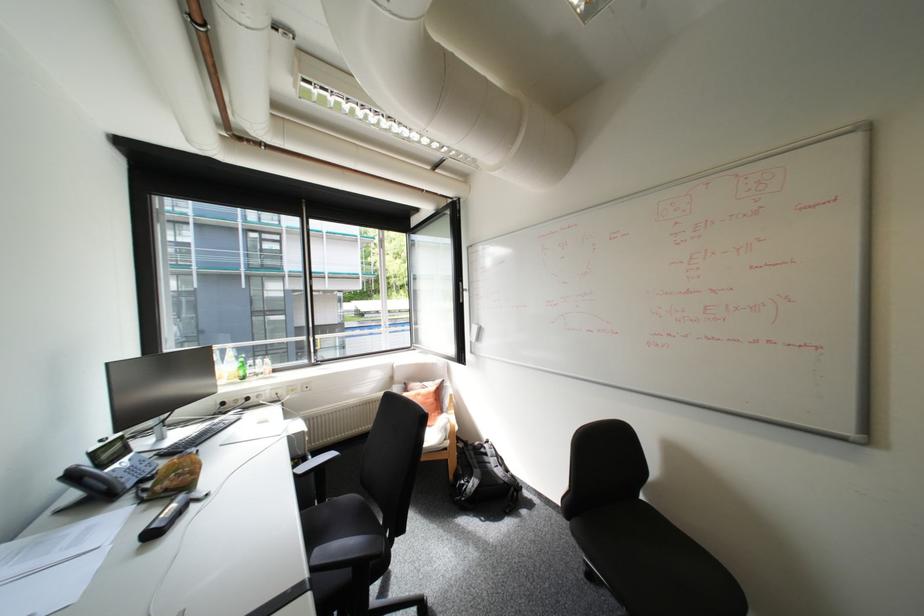
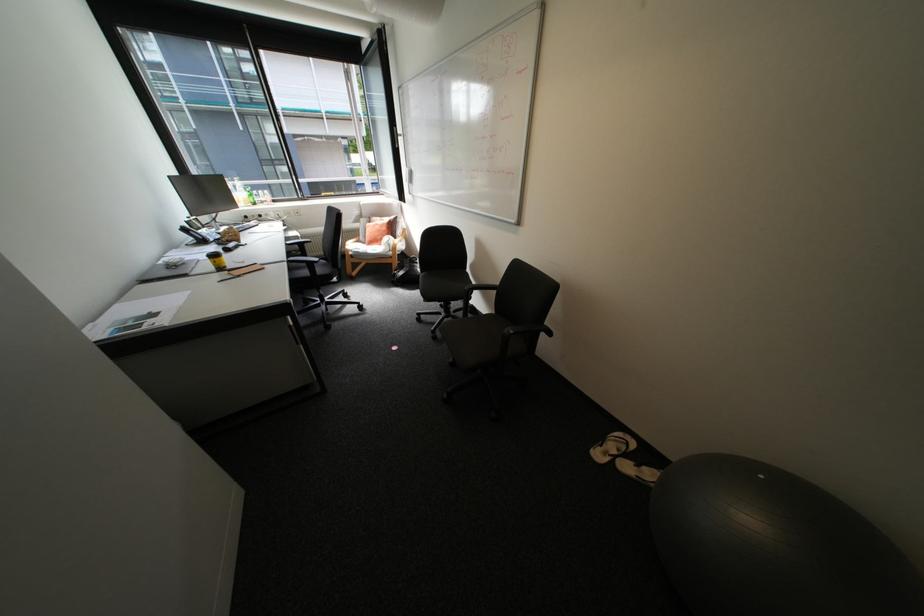
Find the pixel in the second image that matches (456,421) in the first image.

(397, 238)